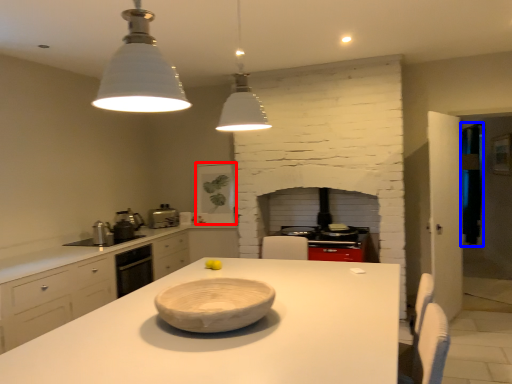
Question: Which point is closer to the camera, appliance (highlighted by a red box) or glass door (highlighted by a blue box)?

Choices:
 (A) appliance
 (B) glass door

Answer: (A)